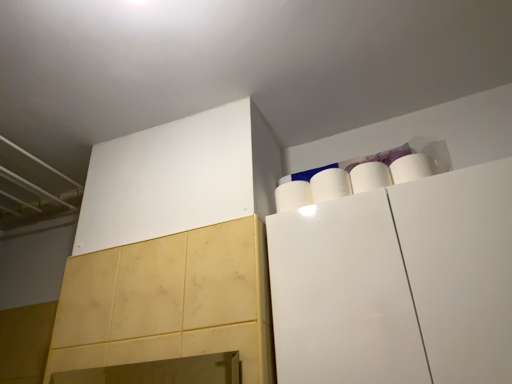
Question: Is white matte cabinet at upper right facing away from white matte paper towel at upper right, arranged as the 2th paper towel when viewed from the right?

Choices:
 (A) yes
 (B) no

Answer: (B)

Question: Is white matte cabinet at upper right located outside white matte paper towel at upper right, arranged as the 2th paper towel when viewed from the right?

Choices:
 (A) no
 (B) yes

Answer: (B)

Question: Is white matte cabinet at upper right shorter than white matte paper towel at upper right, which is the second paper towel from left to right?

Choices:
 (A) yes
 (B) no

Answer: (B)

Question: Does white matte cabinet at upper right turn towards white matte paper towel at upper right, arranged as the 2th paper towel when viewed from the right?

Choices:
 (A) yes
 (B) no

Answer: (B)

Question: Can you confirm if white matte cabinet at upper right is thinner than white matte paper towel at upper right, arranged as the 2th paper towel when viewed from the right?

Choices:
 (A) no
 (B) yes

Answer: (A)

Question: Would you consider white matte cabinet at upper right to be distant from white matte paper towel at upper right, which is the second paper towel from left to right?

Choices:
 (A) yes
 (B) no

Answer: (B)

Question: From a real-world perspective, is white matte paper towel at upper right, arranged as the 2th paper towel when viewed from the right, positioned under white matte paper towel at upper right, the third paper towel in the left-to-right sequence, based on gravity?

Choices:
 (A) no
 (B) yes

Answer: (B)

Question: Does white matte paper towel at upper right, which is the second paper towel from left to right, appear on the right side of white matte paper towel at upper right, the third paper towel in the left-to-right sequence?

Choices:
 (A) yes
 (B) no

Answer: (B)

Question: Is the position of white matte paper towel at upper right, arranged as the 2th paper towel when viewed from the right, more distant than that of white matte paper towel at upper right, which ranks as the 1th paper towel in right-to-left order?

Choices:
 (A) no
 (B) yes

Answer: (B)

Question: Can you confirm if white matte paper towel at upper right, which is the second paper towel from left to right, is shorter than white matte paper towel at upper right, the third paper towel in the left-to-right sequence?

Choices:
 (A) yes
 (B) no

Answer: (A)

Question: Would you say white matte paper towel at upper right, which is the second paper towel from left to right, is a long distance from white matte paper towel at upper right, the third paper towel in the left-to-right sequence?

Choices:
 (A) no
 (B) yes

Answer: (A)

Question: Is white matte paper towel at upper right, which is the second paper towel from left to right, bigger than white matte paper towel at upper right, which ranks as the 1th paper towel in right-to-left order?

Choices:
 (A) no
 (B) yes

Answer: (A)

Question: Considering the relative sizes of white matte paper towel at upper right, arranged as the first paper towel when viewed from the left, and white matte paper towel at upper right, which ranks as the 1th paper towel in right-to-left order, in the image provided, is white matte paper towel at upper right, arranged as the first paper towel when viewed from the left, wider than white matte paper towel at upper right, which ranks as the 1th paper towel in right-to-left order,?

Choices:
 (A) no
 (B) yes

Answer: (B)